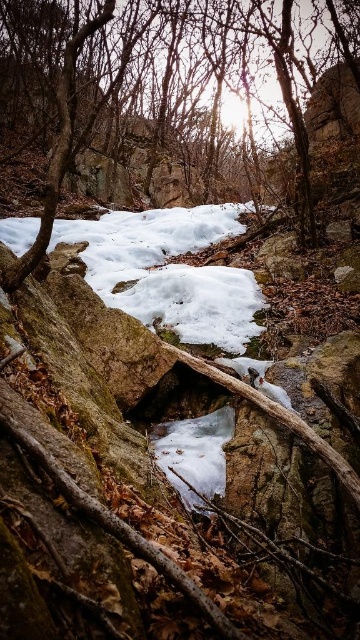
In the scene shown: Does brown wood tree at center have a greater width compared to white frosty snow at center?

Yes, brown wood tree at center is wider than white frosty snow at center.

Who is shorter, brown wood tree at center or white frosty snow at center?

white frosty snow at center

Is point (118, 16) positioned behind point (186, 248)?

Yes, it is.

Locate an element on the screen. The width and height of the screenshot is (360, 640). brown wood tree at center is located at coordinates (164, 97).